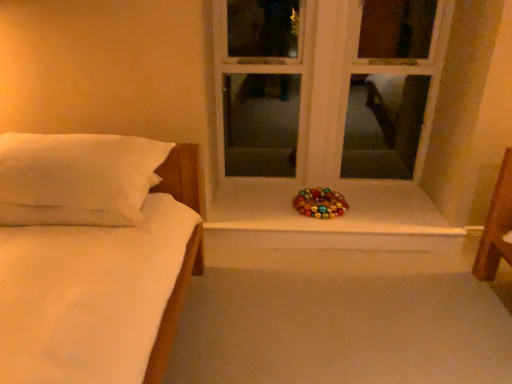
Question: Is white wood window at center outside metallic shiny wreath at center?

Choices:
 (A) yes
 (B) no

Answer: (A)

Question: Does white wood window at center come in front of metallic shiny wreath at center?

Choices:
 (A) no
 (B) yes

Answer: (B)

Question: Considering the relative positions of white wood window at center and metallic shiny wreath at center in the image provided, is white wood window at center to the right of metallic shiny wreath at center from the viewer's perspective?

Choices:
 (A) yes
 (B) no

Answer: (B)

Question: Is white wood window at center looking in the opposite direction of metallic shiny wreath at center?

Choices:
 (A) yes
 (B) no

Answer: (B)

Question: Could you tell me if white wood window at center is turned towards metallic shiny wreath at center?

Choices:
 (A) no
 (B) yes

Answer: (B)

Question: In terms of size, does metallic shiny wreath at center appear bigger or smaller than white wood window at center?

Choices:
 (A) small
 (B) big

Answer: (A)

Question: Considering the positions of metallic shiny wreath at center and white wood window at center in the image, is metallic shiny wreath at center wider or thinner than white wood window at center?

Choices:
 (A) thin
 (B) wide

Answer: (B)

Question: From the image's perspective, is metallic shiny wreath at center above or below white wood window at center?

Choices:
 (A) below
 (B) above

Answer: (A)

Question: Do you think metallic shiny wreath at center is within white wood window at center, or outside of it?

Choices:
 (A) outside
 (B) inside

Answer: (A)

Question: Is white soft pillow at left wider or thinner than metallic shiny wreath at center?

Choices:
 (A) wide
 (B) thin

Answer: (A)

Question: Considering the positions of white soft pillow at left and metallic shiny wreath at center in the image, is white soft pillow at left bigger or smaller than metallic shiny wreath at center?

Choices:
 (A) big
 (B) small

Answer: (A)

Question: In the image, is white soft pillow at left positioned in front of or behind metallic shiny wreath at center?

Choices:
 (A) front
 (B) behind

Answer: (A)

Question: Is point (11, 200) positioned closer to the camera than point (222, 223)?

Choices:
 (A) farther
 (B) closer

Answer: (B)

Question: From a real-world perspective, is white wood window at center positioned above or below white soft pillow at left?

Choices:
 (A) below
 (B) above

Answer: (B)

Question: From the image's perspective, is white wood window at center positioned above or below white soft pillow at left?

Choices:
 (A) above
 (B) below

Answer: (A)